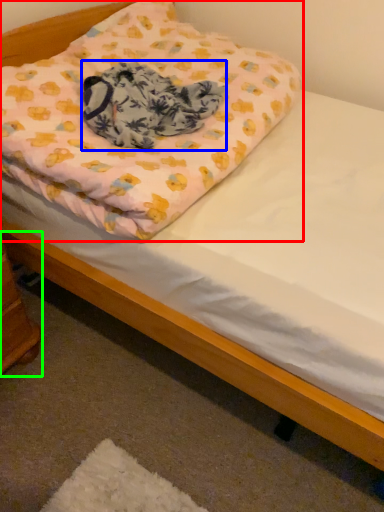
Question: Based on their relative distances, which object is nearer to pillow (highlighted by a red box)? Choose from blanket (highlighted by a blue box) and changing table (highlighted by a green box).

Choices:
 (A) blanket
 (B) changing table

Answer: (A)